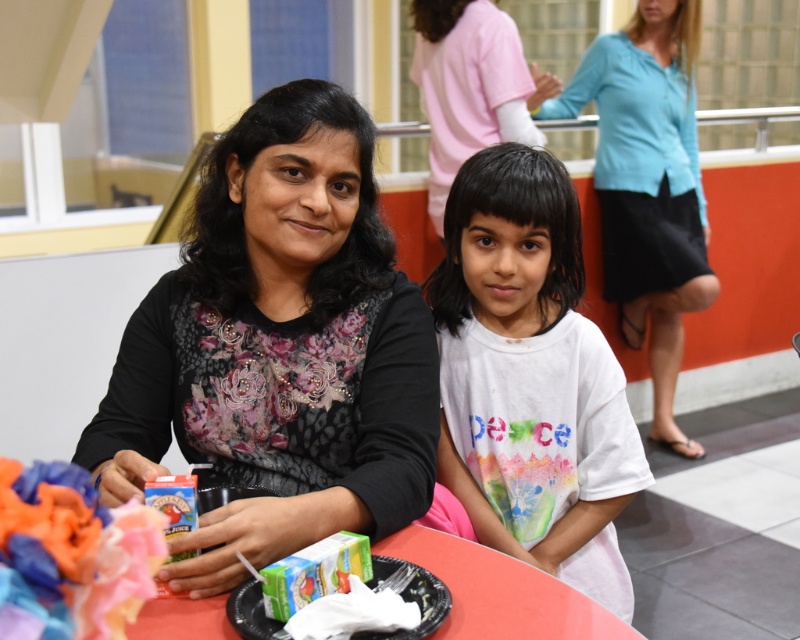
You are a photographer at a family gathering. You need to capture a photo of the white cotton shirt at center and the green cardboard juice box at lower center. To ensure both are in frame, which object should you position closer to the camera?

The white cotton shirt at center is positioned on the right side of the green cardboard juice box at lower center. To ensure both are in frame, position the green cardboard juice box at lower center closer to the camera so that the white cotton shirt at center remains within the shot on its right side.

You are organizing a picnic and need to pack both the blue fabric skirt at upper right and the matte plastic juice box at center. Which item requires more space in your bag?

The blue fabric skirt at upper right requires more space in your bag because it is larger in size than the matte plastic juice box at center.